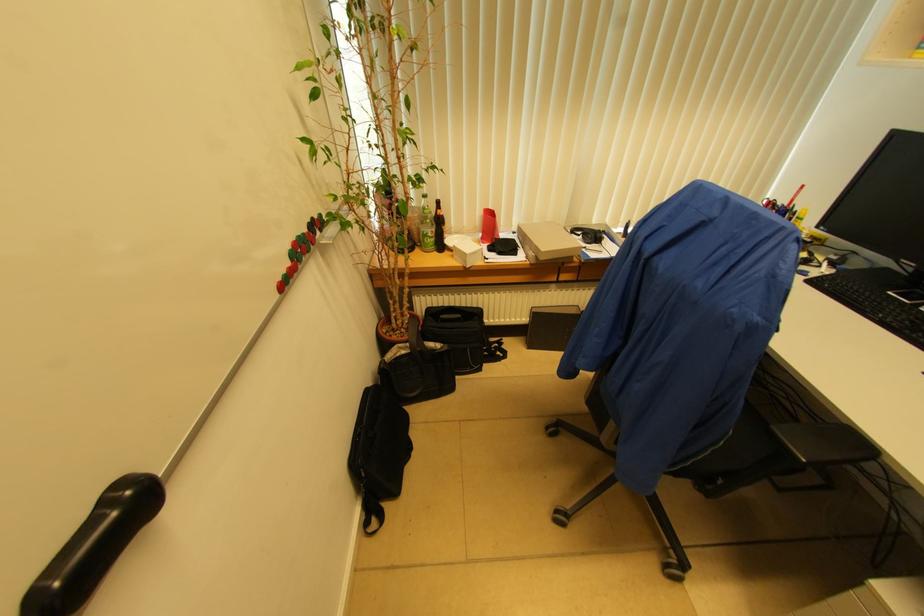
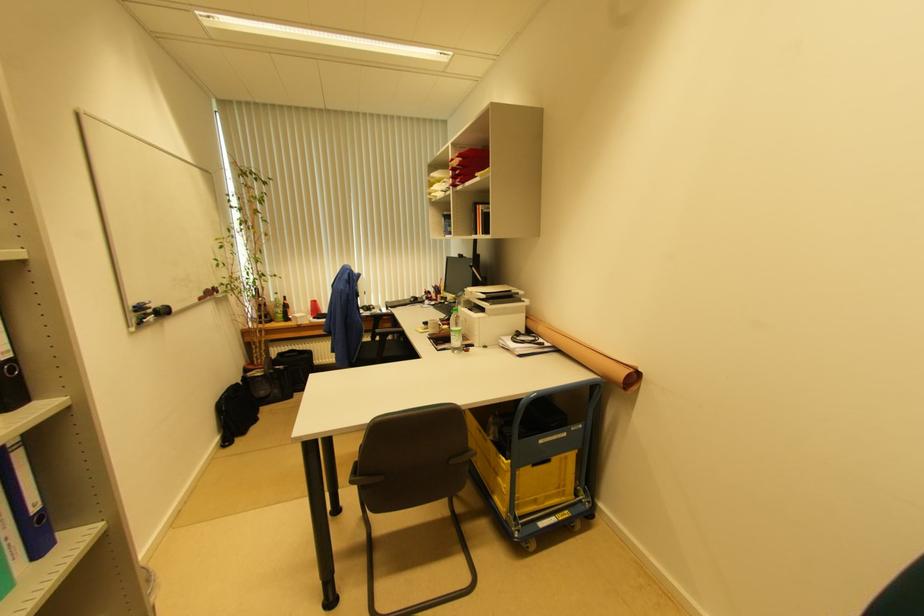
In the second image, find the point that corresponds to point (492, 211) in the first image.

(315, 302)